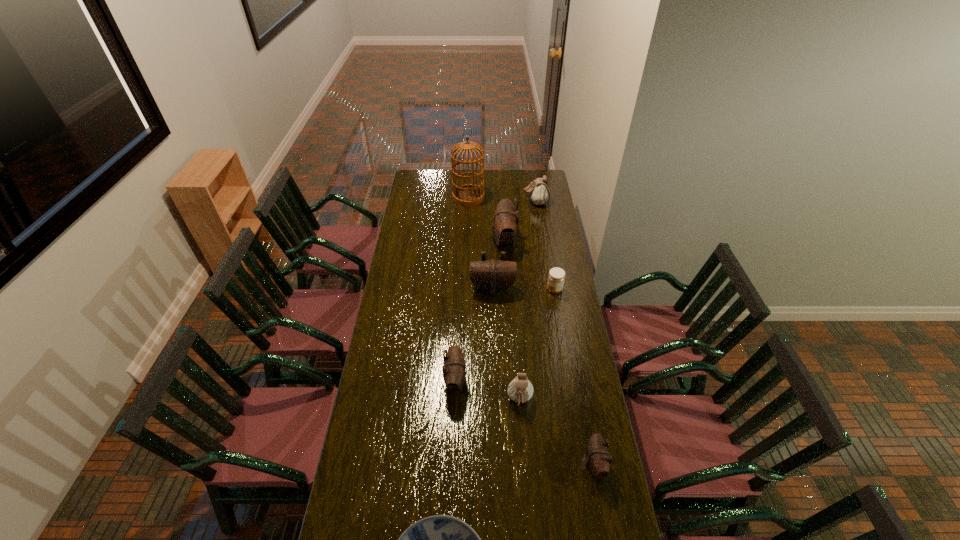
I want to click on the second closest object to the second nearest brown pouch, so click(492, 276).

The image size is (960, 540). I want to click on object that is the seventh closest to the third smallest brown pouch, so click(599, 460).

Locate which pouch is the closest to the farther white pouch. Please provide its 2D coordinates. Your answer should be formatted as a tuple, i.e. [(x, y)], where the tuple contains the x and y coordinates of a point satisfying the conditions above.

[(505, 224)]

Point out which pouch is positioned as the second nearest to the bigger white pouch. Please provide its 2D coordinates. Your answer should be formatted as a tuple, i.e. [(x, y)], where the tuple contains the x and y coordinates of a point satisfying the conditions above.

[(492, 276)]

Identify which brown pouch is located as the nearest to the third farthest brown pouch. Please provide its 2D coordinates. Your answer should be formatted as a tuple, i.e. [(x, y)], where the tuple contains the x and y coordinates of a point satisfying the conditions above.

[(492, 276)]

Find the location of a particular element. The width and height of the screenshot is (960, 540). the third closest brown pouch to the farthest brown pouch is located at coordinates click(x=599, y=460).

This screenshot has height=540, width=960. I want to click on free location that satisfies the following two spatial constraints: 1. with the flap open on the third farthest pouch; 2. with the flap open on the leftmost pouch, so click(x=495, y=382).

Locate an element on the screen. The height and width of the screenshot is (540, 960). vacant area that satisfies the following two spatial constraints: 1. with the flap open on the third farthest object; 2. with the flap open on the fourth nearest pouch is located at coordinates (508, 288).